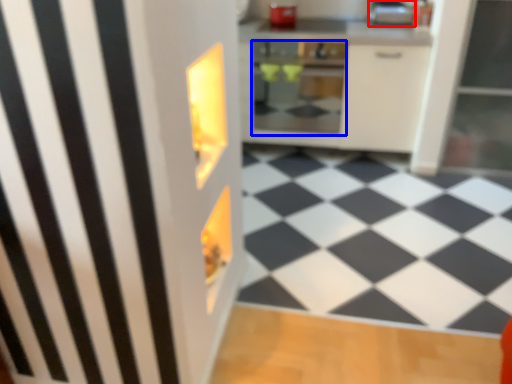
Question: Which point is further to the camera, appliance (highlighted by a red box) or oven (highlighted by a blue box)?

Choices:
 (A) appliance
 (B) oven

Answer: (A)